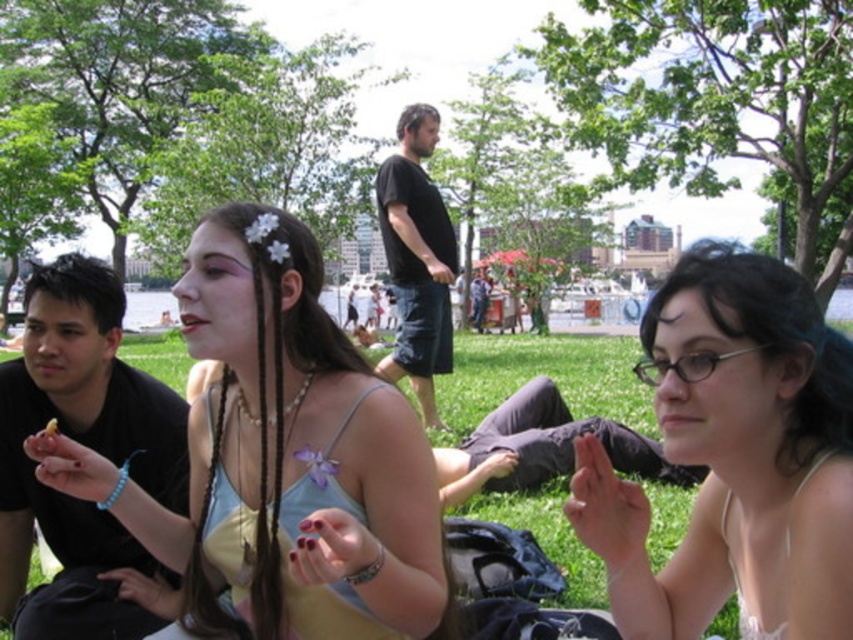
Which of these two, white matte glasses at center or black matte shirt at left, stands shorter?

white matte glasses at center is shorter.

Between white matte glasses at center and black matte shirt at left, which one is positioned higher?

Positioned higher is white matte glasses at center.

I want to click on white matte glasses at center, so click(734, 458).

This screenshot has width=853, height=640. I want to click on white matte glasses at center, so 734,458.

Who is higher up, matte yellow tank top at center or green grass at center?

green grass at center is above.

The image size is (853, 640). What do you see at coordinates (283, 454) in the screenshot?
I see `matte yellow tank top at center` at bounding box center [283, 454].

Is point (419, 611) farther from camera compared to point (585, 368)?

No, (419, 611) is closer to viewer.

I want to click on matte yellow tank top at center, so click(283, 454).

Does point (325, 406) come behind point (86, 268)?

That is False.

Between point (300, 333) and point (33, 316), which one is positioned in front?

Point (300, 333) is in front.

This screenshot has width=853, height=640. I want to click on matte yellow tank top at center, so click(283, 454).